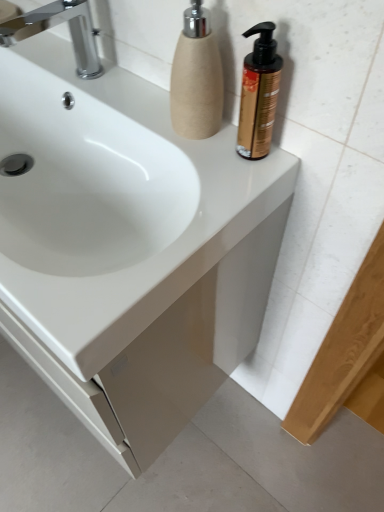
This screenshot has width=384, height=512. Find the location of `blank space to the left of beige textured soap dispenser at upper right, which is the first soap dispenser in left-to-right order`. blank space to the left of beige textured soap dispenser at upper right, which is the first soap dispenser in left-to-right order is located at coordinates (135, 112).